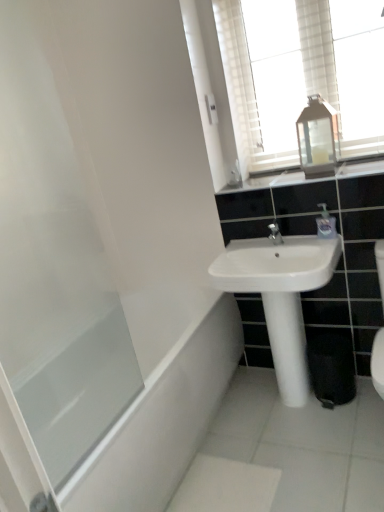
Question: Is clear glass lantern at upper right bigger or smaller than transparent glass bathtub at lower left?

Choices:
 (A) small
 (B) big

Answer: (A)

Question: From the image's perspective, is clear glass lantern at upper right above or below transparent glass bathtub at lower left?

Choices:
 (A) above
 (B) below

Answer: (A)

Question: Which object is positioned closest to the white glossy cabinet at upper center?

Choices:
 (A) clear plastic soap dispenser at upper right
 (B) white ceramic sink at center
 (C) transparent glass bathtub at lower left
 (D) transparent glass screen door at left
 (E) clear glass lantern at upper right

Answer: (A)

Question: Based on their relative distances, which object is nearer to the transparent glass screen door at left?

Choices:
 (A) white ceramic sink at center
 (B) clear glass lantern at upper right
 (C) transparent glass lantern at upper center
 (D) transparent glass bathtub at lower left
 (E) clear plastic soap dispenser at upper right

Answer: (D)